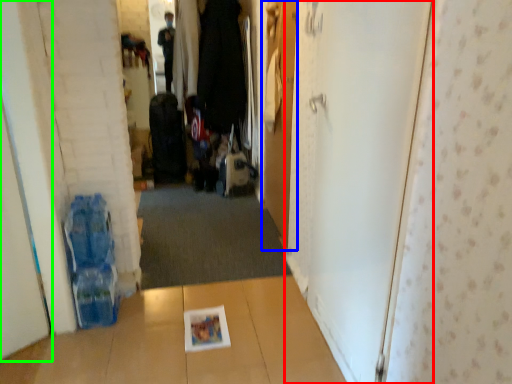
Question: Considering the real-world distances, which object is farthest from door (highlighted by a red box)? door (highlighted by a blue box) or door (highlighted by a green box)?

Choices:
 (A) door
 (B) door

Answer: (B)